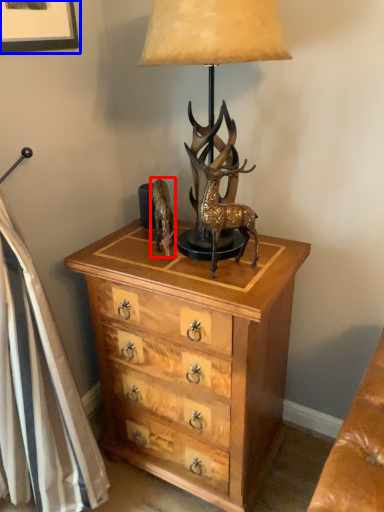
Question: Among these objects, which one is farthest to the camera, animal (highlighted by a red box) or picture frame (highlighted by a blue box)?

Choices:
 (A) animal
 (B) picture frame

Answer: (A)